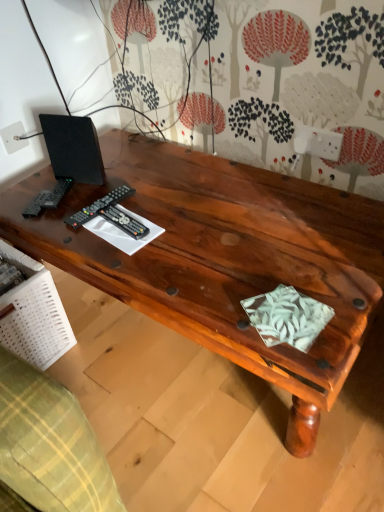
What is the approximate height of black plastic remote at center, acting as the first control starting from the right?

black plastic remote at center, acting as the first control starting from the right, is 1.31 inches tall.

Find the location of a particular element. Image resolution: width=384 pixels, height=512 pixels. black plastic remote at left, which appears as the 1th control when viewed from the left is located at coordinates (98, 206).

I want to click on black plastic remote at center, acting as the first control starting from the right, so click(124, 222).

Is black plastic remote at left, the second control viewed from the right, next to white plastic electric outlet at upper left?

black plastic remote at left, the second control viewed from the right, is not next to white plastic electric outlet at upper left, and they're not touching.

Could you tell me if black plastic remote at left, the second control viewed from the right, is turned towards white plastic electric outlet at upper left?

No, black plastic remote at left, the second control viewed from the right, does not turn towards white plastic electric outlet at upper left.

Can you confirm if black plastic remote at left, the second control viewed from the right, is bigger than white plastic electric outlet at upper left?

Indeed, black plastic remote at left, the second control viewed from the right, has a larger size compared to white plastic electric outlet at upper left.

From the image's perspective, is white plastic electric outlet at upper left on shiny brown wood desk at center?

Indeed, from the image's perspective, white plastic electric outlet at upper left is shown above shiny brown wood desk at center.

This screenshot has height=512, width=384. I want to click on electric outlet above the shiny brown wood desk at center (from a real-world perspective), so click(13, 137).

Considering the sizes of objects white plastic electric outlet at upper left and shiny brown wood desk at center in the image provided, who is wider, white plastic electric outlet at upper left or shiny brown wood desk at center?

shiny brown wood desk at center is wider.

Considering the relative sizes of black matte speaker at upper left and black plastic remote at left, which appears as the 1th control when viewed from the left, in the image provided, is black matte speaker at upper left shorter than black plastic remote at left, which appears as the 1th control when viewed from the left,?

No, black matte speaker at upper left is not shorter than black plastic remote at left, which appears as the 1th control when viewed from the left.

From a real-world perspective, which object stands above the other?

black matte speaker at upper left is physically above.

Is black matte speaker at upper left at the left side of black plastic remote at left, the second control viewed from the right?

Indeed, black matte speaker at upper left is positioned on the left side of black plastic remote at left, the second control viewed from the right.

Identify the location of speaker behind the black plastic remote at left, the second control viewed from the right. The image size is (384, 512). (73, 148).

Could you tell me if black plastic remote at left, the second control viewed from the right, is facing shiny brown wood desk at center?

No.

Find the location of a particular element. The width and height of the screenshot is (384, 512). the 2nd control to the left of the shiny brown wood desk at center, starting your count from the anchor is located at coordinates (98, 206).

From the image's perspective, relative to shiny brown wood desk at center, is black plastic remote at left, the second control viewed from the right, above or below?

black plastic remote at left, the second control viewed from the right, is above shiny brown wood desk at center.

Does point (93, 203) lie in front of point (225, 335)?

No.

Looking at this image, based on their sizes in the image, would you say black plastic remote at center, arranged as the 2th control when viewed from the left, is bigger or smaller than shiny brown wood desk at center?

black plastic remote at center, arranged as the 2th control when viewed from the left, is smaller than shiny brown wood desk at center.

Is black plastic remote at center, acting as the first control starting from the right, taller than shiny brown wood desk at center?

Incorrect, the height of black plastic remote at center, acting as the first control starting from the right, is not larger of that of shiny brown wood desk at center.

Is black plastic remote at center, arranged as the 2th control when viewed from the left, not near shiny brown wood desk at center?

Actually, black plastic remote at center, arranged as the 2th control when viewed from the left, and shiny brown wood desk at center are a little close together.

Locate an element on the screen. The image size is (384, 512). speaker that appears on the right of white plastic electric outlet at upper left is located at coordinates 73,148.

Is black matte speaker at upper left closer to camera compared to white plastic electric outlet at upper left?

That is True.

Considering the sizes of objects black matte speaker at upper left and white plastic electric outlet at upper left in the image provided, who is taller, black matte speaker at upper left or white plastic electric outlet at upper left?

black matte speaker at upper left.

Does black matte speaker at upper left contain white plastic electric outlet at upper left?

No, white plastic electric outlet at upper left is not surrounded by black matte speaker at upper left.

How distant is black plastic remote at left, which appears as the 1th control when viewed from the left, from black matte speaker at upper left?

They are 7.38 inches apart.

Considering their positions, is black plastic remote at left, the second control viewed from the right, located in front of or behind black matte speaker at upper left?

Visually, black plastic remote at left, the second control viewed from the right, is located in front of black matte speaker at upper left.

Is black plastic remote at left, the second control viewed from the right, far from black matte speaker at upper left?

black plastic remote at left, the second control viewed from the right, is actually quite close to black matte speaker at upper left.

Identify the location of electric outlet located above the black plastic remote at left, which appears as the 1th control when viewed from the left (from a real-world perspective). (13, 137).

You are a GUI agent. You are given a task and a screenshot of the screen. Output one action in this format:
    pyautogui.click(x=<x>, y=<y>)
    Task: Click on the electric outlet above the shiny brown wood desk at center (from the image's perspective)
    
    Given the screenshot: What is the action you would take?
    pyautogui.click(x=13, y=137)

Which object lies nearer to the anchor point black matte speaker at upper left, black plastic remote at center, arranged as the 2th control when viewed from the left, or shiny brown wood desk at center?

black plastic remote at center, arranged as the 2th control when viewed from the left.

In the scene shown: Based on their spatial positions, is black plastic remote at left, which appears as the 1th control when viewed from the left, or white plastic electric outlet at upper left further from black matte speaker at upper left?

white plastic electric outlet at upper left.

Based on their spatial positions, is black plastic remote at center, acting as the first control starting from the right, or shiny brown wood desk at center further from black plastic remote at left, which appears as the 1th control when viewed from the left?

shiny brown wood desk at center.

Based on their spatial positions, is black plastic remote at center, arranged as the 2th control when viewed from the left, or black plastic remote at left, the second control viewed from the right, closer to black matte speaker at upper left?

Among the two, black plastic remote at left, the second control viewed from the right, is located nearer to black matte speaker at upper left.

When comparing their distances from white plastic electric outlet at upper left, does black plastic remote at left, which appears as the 1th control when viewed from the left, or black matte speaker at upper left seem closer?

black matte speaker at upper left is closer to white plastic electric outlet at upper left.

Based on the photo, when comparing their distances from black plastic remote at center, arranged as the 2th control when viewed from the left, does black plastic remote at left, the second control viewed from the right, or black matte speaker at upper left seem further?

The object further to black plastic remote at center, arranged as the 2th control when viewed from the left, is black matte speaker at upper left.

Based on their spatial positions, is white plastic electric outlet at upper left or black matte speaker at upper left further from black plastic remote at left, which appears as the 1th control when viewed from the left?

white plastic electric outlet at upper left lies further to black plastic remote at left, which appears as the 1th control when viewed from the left, than the other object.

Considering their positions, is black matte speaker at upper left positioned closer to white plastic electric outlet at upper left than shiny brown wood desk at center?

black matte speaker at upper left is positioned closer to the anchor white plastic electric outlet at upper left.

Where is `speaker located between white plastic electric outlet at upper left and black plastic remote at left, which appears as the 1th control when viewed from the left, in the left-right direction`? speaker located between white plastic electric outlet at upper left and black plastic remote at left, which appears as the 1th control when viewed from the left, in the left-right direction is located at coordinates (73, 148).

Where is `control between white plastic electric outlet at upper left and black plastic remote at center, acting as the first control starting from the right`? The height and width of the screenshot is (512, 384). control between white plastic electric outlet at upper left and black plastic remote at center, acting as the first control starting from the right is located at coordinates (98, 206).

Locate an element on the screen. speaker between white plastic electric outlet at upper left and black plastic remote at center, acting as the first control starting from the right, in the horizontal direction is located at coordinates (73, 148).

You are a GUI agent. You are given a task and a screenshot of the screen. Output one action in this format:
    pyautogui.click(x=<x>, y=<y>)
    Task: Click on the control between shiny brown wood desk at center and black plastic remote at left, which appears as the 1th control when viewed from the left, from front to back
    
    Given the screenshot: What is the action you would take?
    pyautogui.click(x=124, y=222)